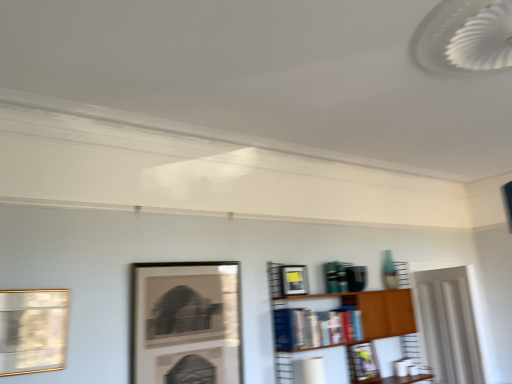
Question: Is matte black picture frame at upper center, placed as the first picture frame when sorted from back to front, aimed at matte black picture frame at center, which appears as the third picture frame when viewed from the back?

Choices:
 (A) yes
 (B) no

Answer: (B)

Question: From the image's perspective, would you say matte black picture frame at upper center, which appears as the fourth picture frame when viewed from the front, is positioned over matte black picture frame at center, which appears as the third picture frame when viewed from the back?

Choices:
 (A) no
 (B) yes

Answer: (A)

Question: Considering the relative sizes of matte black picture frame at upper center, placed as the first picture frame when sorted from back to front, and matte black picture frame at center, which appears as the second picture frame when viewed from the left, in the image provided, is matte black picture frame at upper center, placed as the first picture frame when sorted from back to front, thinner than matte black picture frame at center, which appears as the second picture frame when viewed from the left,?

Choices:
 (A) no
 (B) yes

Answer: (A)

Question: Is matte black picture frame at center, which appears as the second picture frame when viewed from the left, inside matte black picture frame at upper center, which appears as the fourth picture frame when viewed from the front?

Choices:
 (A) yes
 (B) no

Answer: (B)

Question: Can you confirm if matte black picture frame at upper center, placed as the first picture frame when sorted from back to front, is taller than matte black picture frame at center, which appears as the 2th picture frame when viewed from the front?

Choices:
 (A) no
 (B) yes

Answer: (A)

Question: Considering the relative positions of hardcover books at center and matte black picture frame at upper center, which is the fourth picture frame in left-to-right order, in the image provided, is hardcover books at center to the left or to the right of matte black picture frame at upper center, which is the fourth picture frame in left-to-right order,?

Choices:
 (A) left
 (B) right

Answer: (A)

Question: Based on their sizes in the image, would you say hardcover books at center is bigger or smaller than matte black picture frame at upper center, which is the fourth picture frame in left-to-right order?

Choices:
 (A) small
 (B) big

Answer: (B)

Question: Is hardcover books at center inside the boundaries of matte black picture frame at upper center, which appears as the fourth picture frame when viewed from the front, or outside?

Choices:
 (A) inside
 (B) outside

Answer: (B)

Question: From a real-world perspective, is hardcover books at center positioned above or below matte black picture frame at upper center, which appears as the fourth picture frame when viewed from the front?

Choices:
 (A) below
 (B) above

Answer: (B)

Question: Is point (385, 324) positioned closer to the camera than point (335, 324)?

Choices:
 (A) farther
 (B) closer

Answer: (A)

Question: Is wooden bookshelf at center-right bigger or smaller than hardcover books at center?

Choices:
 (A) small
 (B) big

Answer: (B)

Question: Would you say wooden bookshelf at center-right is inside or outside hardcover books at center?

Choices:
 (A) inside
 (B) outside

Answer: (B)

Question: Considering the positions of wooden bookshelf at center-right and hardcover books at center in the image, is wooden bookshelf at center-right taller or shorter than hardcover books at center?

Choices:
 (A) tall
 (B) short

Answer: (A)

Question: Is wooden bookshelf at center-right bigger or smaller than matte black picture frame at upper center, placed as the first picture frame when sorted from back to front?

Choices:
 (A) small
 (B) big

Answer: (B)

Question: In the image, is wooden bookshelf at center-right on the left side or the right side of matte black picture frame at upper center, which appears as the fourth picture frame when viewed from the front?

Choices:
 (A) left
 (B) right

Answer: (A)